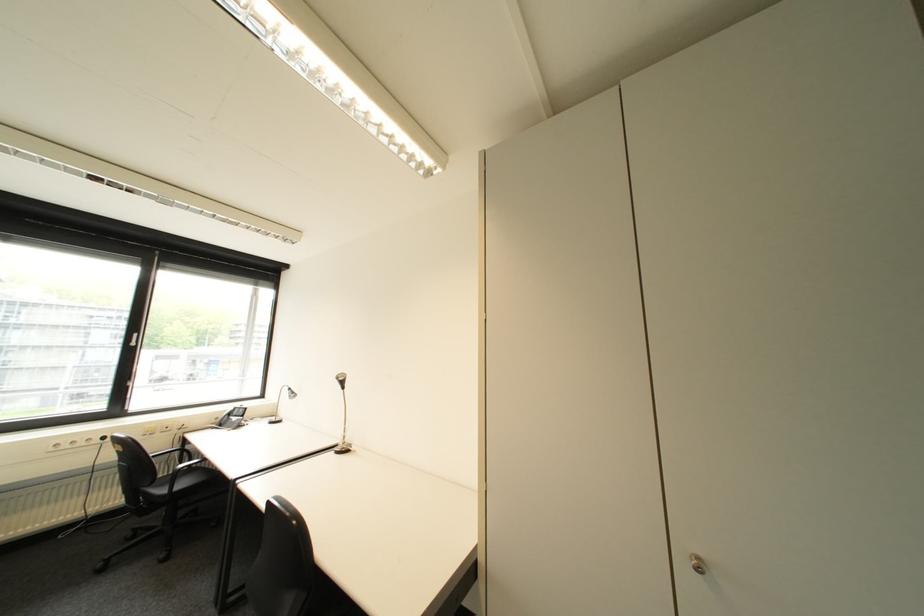
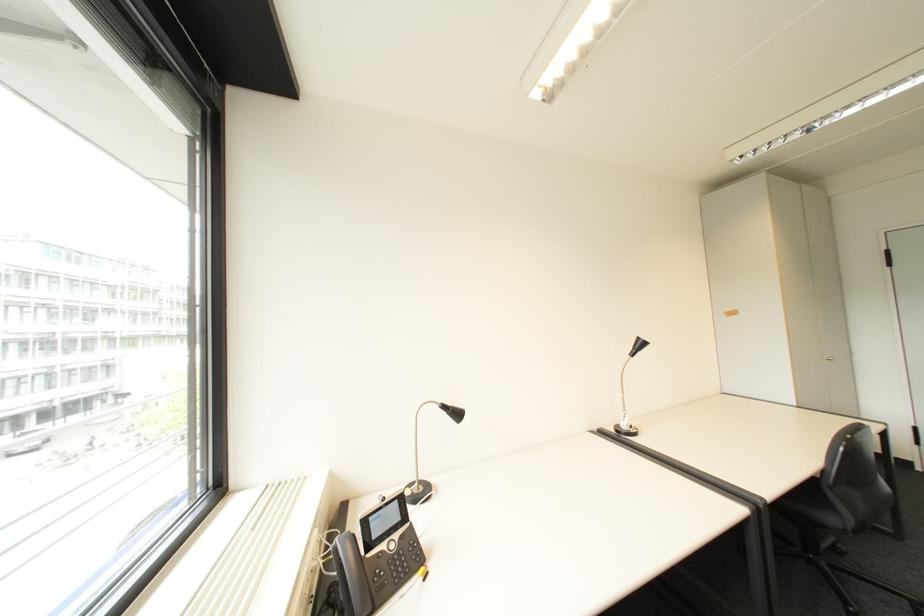
In the second image, find the point that corresponds to point 299,390 in the first image.

(455, 407)